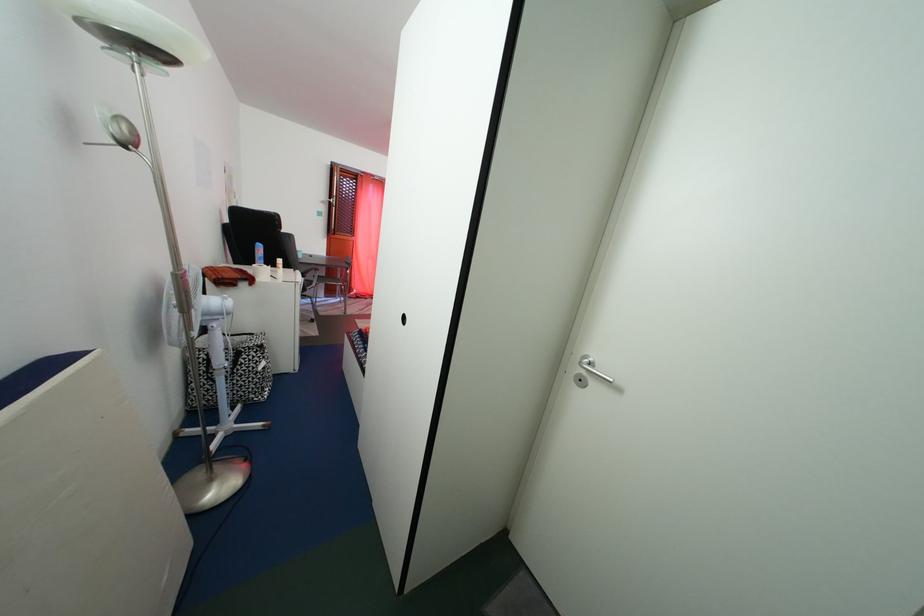
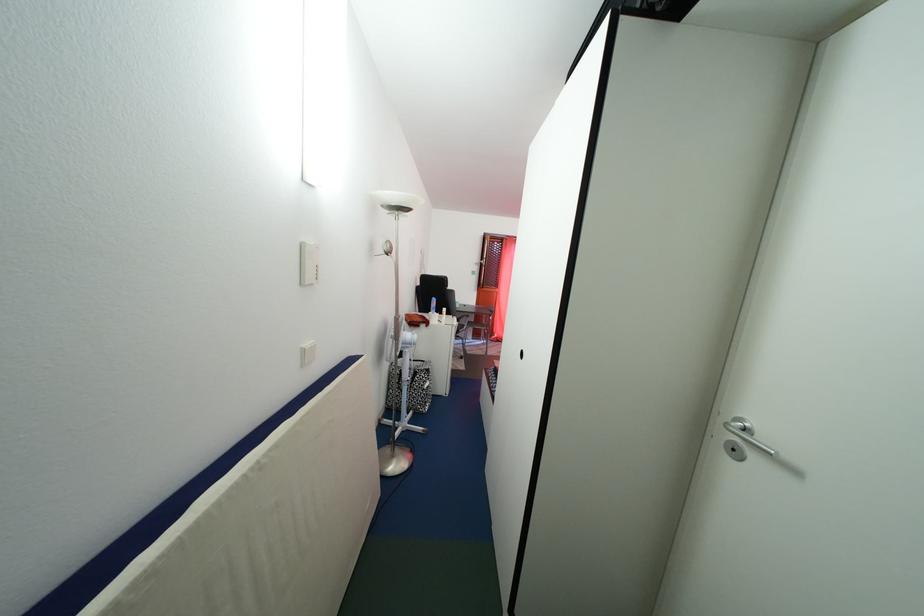
In the second image, find the point that corresponds to the point at 309,262 in the first image.

(466, 313)